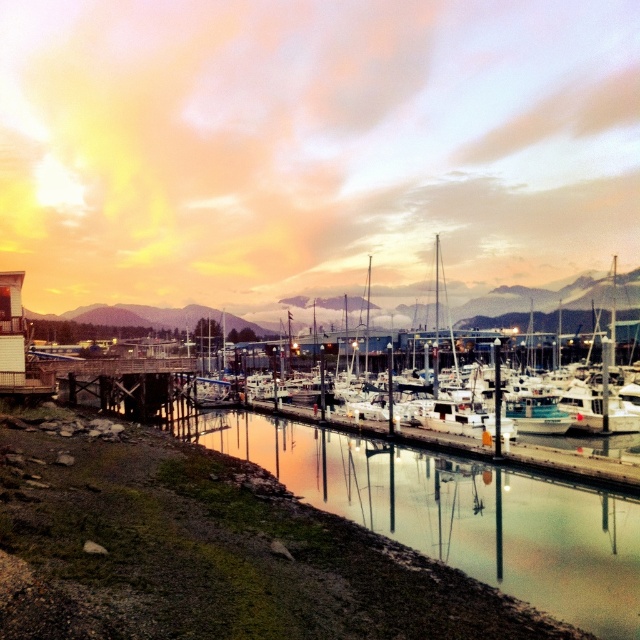
You are standing at the edge of a serene marina with a point marked at coordinates point (x=593, y=310). You want to know how far this point is from your current position. Can you determine the distance?

The distance of point (x=593, y=310) from viewer is 149.41 meters.

You are standing on the wooden dock at lower left and want to board the white matte boat at center. Is the boat directly above the dock?

The white matte boat at center is positioned over wooden dock at lower left, so yes, the boat is directly above the dock, making it easy to board from the dock.

You are a boat operator who needs to maneuver your vessel through a narrow channel. You observe the white matte boat at center and the wooden dock at lower left. Which object has a greater width, and how does this affect your navigation plan?

The white matte boat at center has a greater width than the wooden dock at lower left. This means that the boat is wider than the dock, so you must ensure there is sufficient space to navigate around or past the dock without collision, considering the boat requires more width for safe passage.